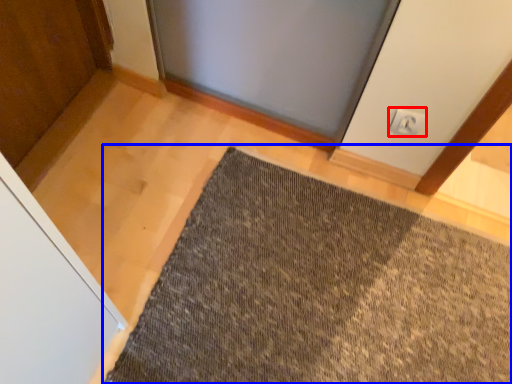
Question: Which of the following is the closest to the observer, electric outlet (highlighted by a red box) or mat (highlighted by a blue box)?

Choices:
 (A) electric outlet
 (B) mat

Answer: (B)